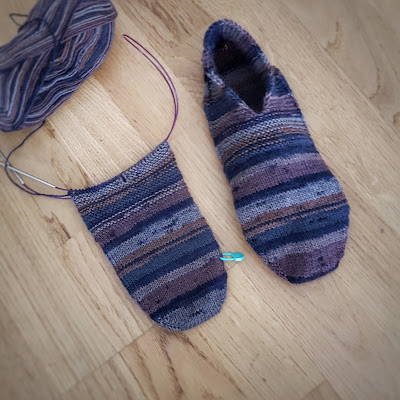
This screenshot has width=400, height=400. What are the coordinates of `snippit of blonde wood in (my) upper left corner` in the screenshot? It's located at tap(9, 8).